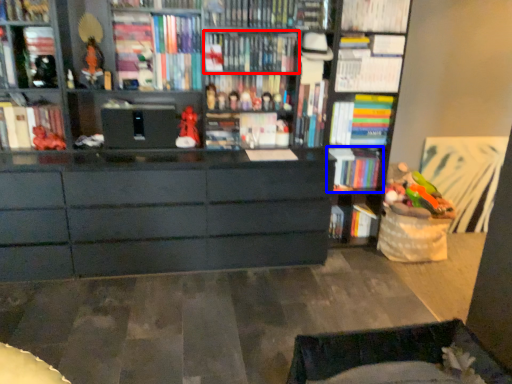
Question: Among these objects, which one is nearest to the camera, book (highlighted by a red box) or book (highlighted by a blue box)?

Choices:
 (A) book
 (B) book

Answer: (A)